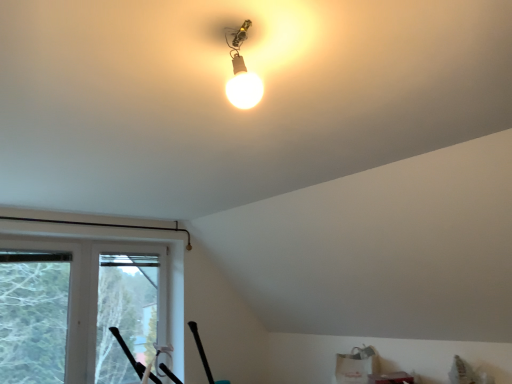
Question: Would you say matte glass bulb at upper center is a long distance from transparent plastic window screen at lower left, which appears as the second window screen when viewed from the left?

Choices:
 (A) yes
 (B) no

Answer: (A)

Question: Can you confirm if matte glass bulb at upper center is taller than transparent plastic window screen at lower left, which appears as the first window screen when viewed from the right?

Choices:
 (A) no
 (B) yes

Answer: (A)

Question: Is matte glass bulb at upper center aimed at transparent plastic window screen at lower left, which appears as the first window screen when viewed from the right?

Choices:
 (A) yes
 (B) no

Answer: (B)

Question: Is matte glass bulb at upper center looking in the opposite direction of transparent plastic window screen at lower left, which appears as the first window screen when viewed from the right?

Choices:
 (A) no
 (B) yes

Answer: (A)

Question: Are matte glass bulb at upper center and transparent plastic window screen at lower left, which appears as the first window screen when viewed from the right, beside each other?

Choices:
 (A) no
 (B) yes

Answer: (A)

Question: From the image's perspective, is transparent plastic window screen at lower left, which appears as the second window screen when viewed from the left, positioned above or below matte glass bulb at upper center?

Choices:
 (A) above
 (B) below

Answer: (B)

Question: Based on their sizes in the image, would you say transparent plastic window screen at lower left, which appears as the second window screen when viewed from the left, is bigger or smaller than matte glass bulb at upper center?

Choices:
 (A) small
 (B) big

Answer: (B)

Question: In terms of height, does transparent plastic window screen at lower left, which appears as the second window screen when viewed from the left, look taller or shorter compared to matte glass bulb at upper center?

Choices:
 (A) short
 (B) tall

Answer: (B)

Question: Is transparent plastic window screen at lower left, which appears as the first window screen when viewed from the right, wider or thinner than matte glass bulb at upper center?

Choices:
 (A) wide
 (B) thin

Answer: (B)

Question: Looking at the image, does transparent plastic window screen at lower left, which appears as the first window screen when viewed from the right, seem bigger or smaller compared to transparent plastic window screen at left, which is the 2th window screen from right to left?

Choices:
 (A) small
 (B) big

Answer: (B)

Question: From the image's perspective, is transparent plastic window screen at lower left, which appears as the first window screen when viewed from the right, above or below transparent plastic window screen at left, which is the 2th window screen from right to left?

Choices:
 (A) above
 (B) below

Answer: (B)

Question: Considering the positions of transparent plastic window screen at lower left, which appears as the second window screen when viewed from the left, and transparent plastic window screen at left, which is the 2th window screen from right to left, in the image, is transparent plastic window screen at lower left, which appears as the second window screen when viewed from the left, wider or thinner than transparent plastic window screen at left, which is the 2th window screen from right to left,?

Choices:
 (A) thin
 (B) wide

Answer: (B)

Question: Does point (137, 266) appear closer or farther from the camera than point (56, 304)?

Choices:
 (A) farther
 (B) closer

Answer: (A)

Question: Visually, is matte glass bulb at upper center positioned to the left or to the right of transparent plastic window screen at left, which is counted as the 1th window screen, starting from the left?

Choices:
 (A) right
 (B) left

Answer: (A)

Question: In terms of size, does matte glass bulb at upper center appear bigger or smaller than transparent plastic window screen at left, which is the 2th window screen from right to left?

Choices:
 (A) big
 (B) small

Answer: (B)